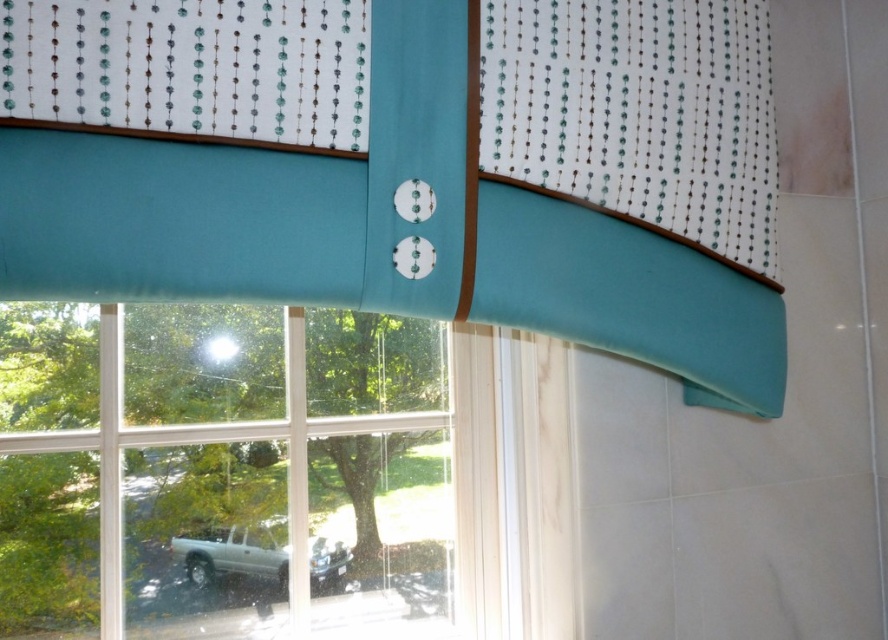
Question: Is teal fabric valance at upper center smaller than clear glass window at center?

Choices:
 (A) no
 (B) yes

Answer: (A)

Question: Does teal fabric valance at upper center appear on the left side of clear glass window at center?

Choices:
 (A) no
 (B) yes

Answer: (A)

Question: Can you confirm if teal fabric valance at upper center is positioned below clear glass window at center?

Choices:
 (A) yes
 (B) no

Answer: (B)

Question: Which point is farther to the camera?

Choices:
 (A) (657, 252)
 (B) (244, 548)

Answer: (B)

Question: Which point appears closest to the camera in this image?

Choices:
 (A) (123, 307)
 (B) (280, 276)

Answer: (B)

Question: Which point is farther to the camera?

Choices:
 (A) teal fabric valance at upper center
 (B) clear glass window at center

Answer: (B)